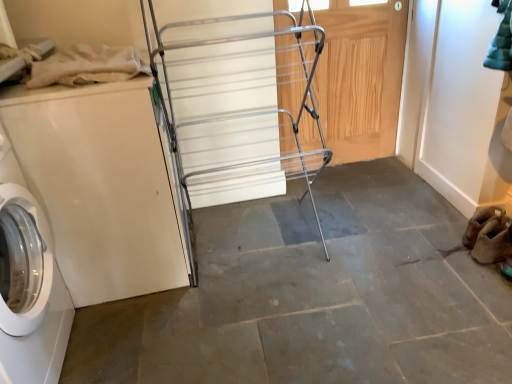
Image resolution: width=512 pixels, height=384 pixels. Describe the element at coordinates (100, 185) in the screenshot. I see `white glossy washing machine at left` at that location.

Describe the element at coordinates (361, 78) in the screenshot. I see `wooden door at center` at that location.

In order to click on wooden door at center in this screenshot , I will do `click(361, 78)`.

Find the location of `white glossy washing machine at left`. white glossy washing machine at left is located at coordinates (100, 185).

Based on the photo, is white glossy washing machine at left at the back of silver metallic drying rack at center?

No.

Does silver metallic drying rack at center come in front of white glossy washing machine at left?

Yes, silver metallic drying rack at center is closer to the camera.

Which is closer to the camera, (x=271, y=78) or (x=108, y=298)?

Point (x=271, y=78) appears to be farther away from the viewer than point (x=108, y=298).

Which of these two, silver metallic drying rack at center or white glossy washing machine at left, is wider?

Wider between the two is silver metallic drying rack at center.

From a real-world perspective, is wooden door at center physically located above or below white glossy washing machine at left?

wooden door at center is situated higher than white glossy washing machine at left in the real world.

Is point (385, 13) more distant than point (165, 191)?

Yes, point (385, 13) is behind point (165, 191).

Considering the sizes of wooden door at center and white glossy washing machine at left in the image, is wooden door at center taller or shorter than white glossy washing machine at left?

Considering their sizes, wooden door at center has more height than white glossy washing machine at left.

Is wooden door at center further to the viewer compared to white glossy washing machine at left?

Yes, wooden door at center is further from the camera.

Looking at this image, is white glossy washing machine at left completely or partially outside of silver metallic drying rack at center?

That's correct, white glossy washing machine at left is outside of silver metallic drying rack at center.

In the scene shown: Is white glossy washing machine at left bigger than silver metallic drying rack at center?

Incorrect, white glossy washing machine at left is not larger than silver metallic drying rack at center.

Could you tell me if white glossy washing machine at left is facing silver metallic drying rack at center?

Yes, white glossy washing machine at left is facing silver metallic drying rack at center.

Does white glossy washing machine at left have a greater width compared to silver metallic drying rack at center?

Incorrect, the width of white glossy washing machine at left does not surpass that of silver metallic drying rack at center.

Does point (69, 198) come farther from viewer compared to point (345, 128)?

No, (69, 198) is closer to viewer.

From a real-world perspective, who is located lower, white glossy washing machine at left or wooden door at center?

From a 3D spatial view, white glossy washing machine at left is below.

From a real-world perspective, is wooden door at center under silver metallic drying rack at center?

Yes, from a real-world perspective, wooden door at center is beneath silver metallic drying rack at center.

Is point (353, 37) positioned behind point (220, 51)?

Yes.

From the image's perspective, is silver metallic drying rack at center under wooden door at center?

Yes, from the image's perspective, silver metallic drying rack at center is beneath wooden door at center.

Between silver metallic drying rack at center and wooden door at center, which one is positioned in front?

silver metallic drying rack at center is in front.

Does silver metallic drying rack at center touch wooden door at center?

No, silver metallic drying rack at center is not touching wooden door at center.

Between silver metallic drying rack at center and wooden door at center, which one has smaller width?

Thinner between the two is wooden door at center.

In the image, there is a silver metallic drying rack at center. Where is `washing machine below it (from a real-world perspective)`? washing machine below it (from a real-world perspective) is located at coordinates (100, 185).

In order to click on washing machine that is in front of the wooden door at center in this screenshot , I will do `click(100, 185)`.

Looking at the image, which one is located closer to white glossy washing machine at left, silver metallic drying rack at center or wooden door at center?

silver metallic drying rack at center is closer to white glossy washing machine at left.

Considering their positions, is white glossy washing machine at left positioned further to silver metallic drying rack at center than wooden door at center?

The object further to silver metallic drying rack at center is white glossy washing machine at left.

From the image, which object appears to be nearer to wooden door at center, silver metallic drying rack at center or white glossy washing machine at left?

silver metallic drying rack at center is closer to wooden door at center.

Estimate the real-world distances between objects in this image. Which object is closer to wooden door at center, white glossy washing machine at left or silver metallic drying rack at center?

silver metallic drying rack at center is closer to wooden door at center.

Looking at this image, looking at the image, which one is located further to silver metallic drying rack at center, wooden door at center or white glossy washing machine at left?

white glossy washing machine at left lies further to silver metallic drying rack at center than the other object.

Estimate the real-world distances between objects in this image. Which object is further from white glossy washing machine at left, wooden door at center or silver metallic drying rack at center?

wooden door at center is positioned further to the anchor white glossy washing machine at left.

The image size is (512, 384). In order to click on cart between white glossy washing machine at left and wooden door at center in the horizontal direction in this screenshot , I will do `click(234, 106)`.